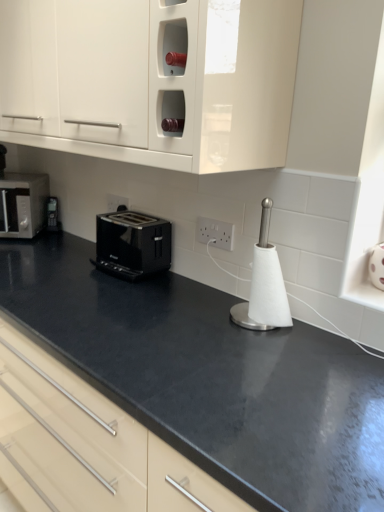
Question: Is matte silver toaster at left wider or thinner than white glossy cabinet at upper center?

Choices:
 (A) thin
 (B) wide

Answer: (A)

Question: Is matte silver toaster at left inside the boundaries of white glossy cabinet at upper center, or outside?

Choices:
 (A) inside
 (B) outside

Answer: (B)

Question: Estimate the real-world distances between objects in this image. Which object is farther from the white plastic electric outlet at center, the 1th electric outlet from the front?

Choices:
 (A) white plastic electrical outlet at center, the 2th electric outlet from the front
 (B) white glossy cabinet at upper center
 (C) black glossy toaster at center
 (D) matte silver toaster at left
 (E) white paper towel holder at center

Answer: (D)

Question: Which object is the closest to the white glossy cabinet at upper center?

Choices:
 (A) matte silver toaster at left
 (B) white plastic electric outlet at center, the 1th electric outlet from the front
 (C) black glossy toaster at center
 (D) white plastic electrical outlet at center, placed as the second electric outlet when sorted from right to left
 (E) white paper towel holder at center

Answer: (E)